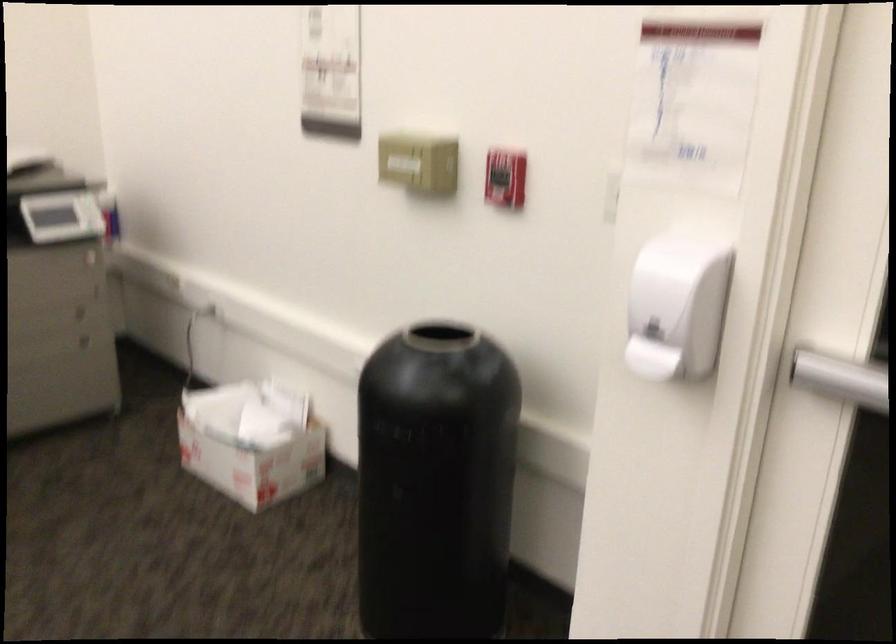
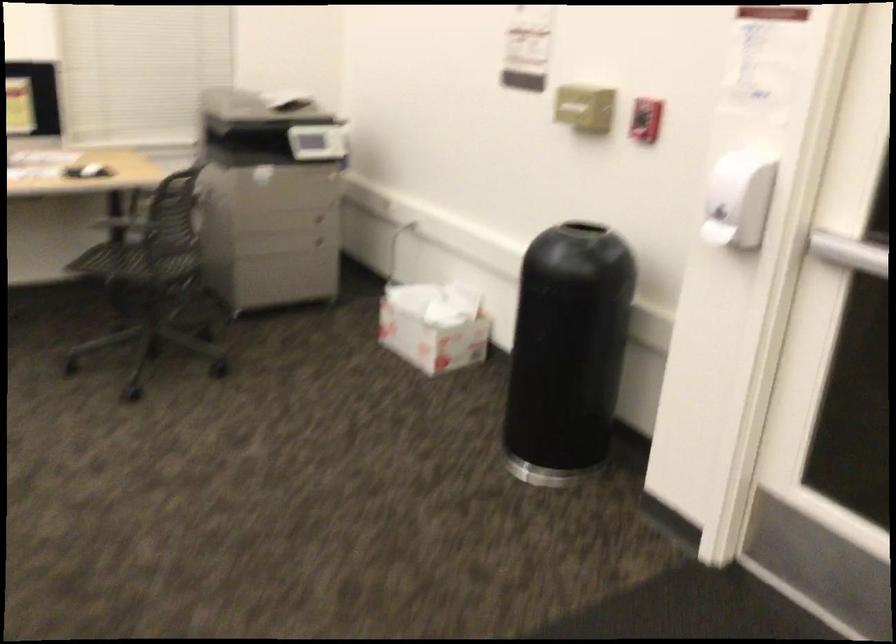
Question: The first image is from the beginning of the video and the second image is from the end. How did the camera likely rotate when shooting the video?

Choices:
 (A) Left
 (B) Right
 (C) Up
 (D) Down

Answer: (A)